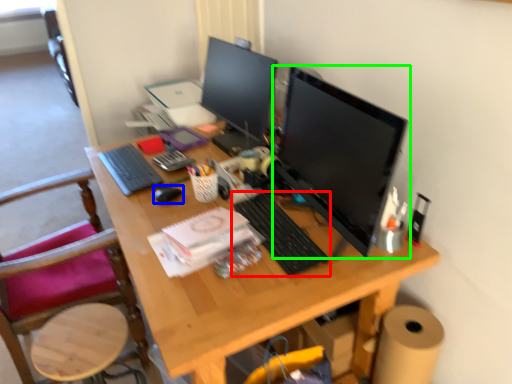
Question: Which is farther away from computer keyboard (highlighted by a red box)? mouse (highlighted by a blue box) or computer monitor (highlighted by a green box)?

Choices:
 (A) mouse
 (B) computer monitor

Answer: (A)